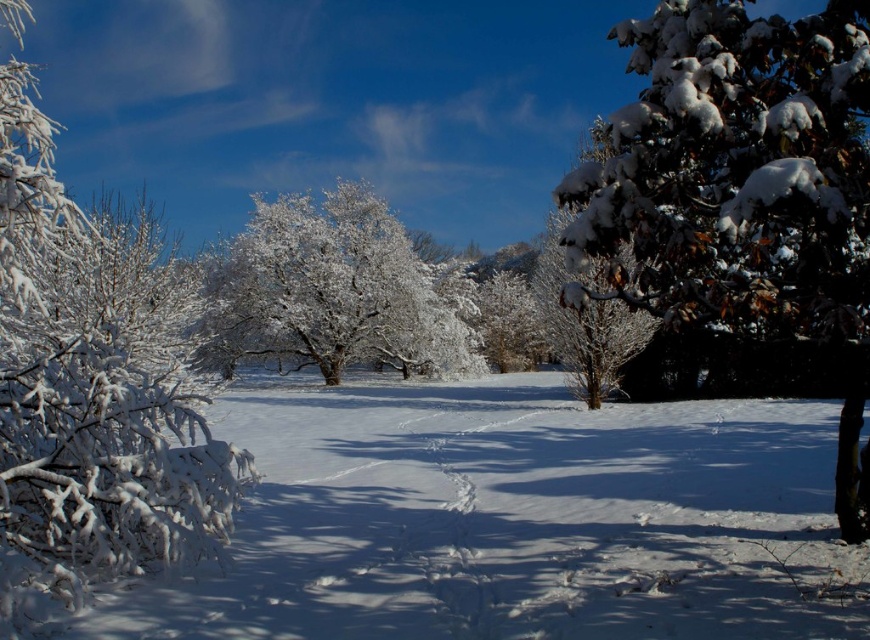
Which is below, snow-covered tree at center-right or white frosty bush at center?

white frosty bush at center is lower down.

Between snow-covered tree at center-right and white frosty bush at center, which one appears on the left side from the viewer's perspective?

From the viewer's perspective, snow-covered tree at center-right appears more on the left side.

Where is `snow-covered tree at center-right`? Image resolution: width=870 pixels, height=640 pixels. snow-covered tree at center-right is located at coordinates (586, 321).

Does white frosty tree at center appear on the right side of snow-covered tree at center-right?

Incorrect, white frosty tree at center is not on the right side of snow-covered tree at center-right.

Is white frosty tree at center positioned at the back of snow-covered tree at center-right?

Yes, white frosty tree at center is further from the viewer.

This screenshot has height=640, width=870. Find the location of `white frosty tree at center`. white frosty tree at center is located at coordinates (328, 291).

Is white frosty branches at left closer to camera compared to white frosty tree at center?

Yes.

Is point (135, 572) positioned behind point (209, 371)?

No, (135, 572) is in front of (209, 371).

Find the location of a particular element. The height and width of the screenshot is (640, 870). white frosty branches at left is located at coordinates (91, 381).